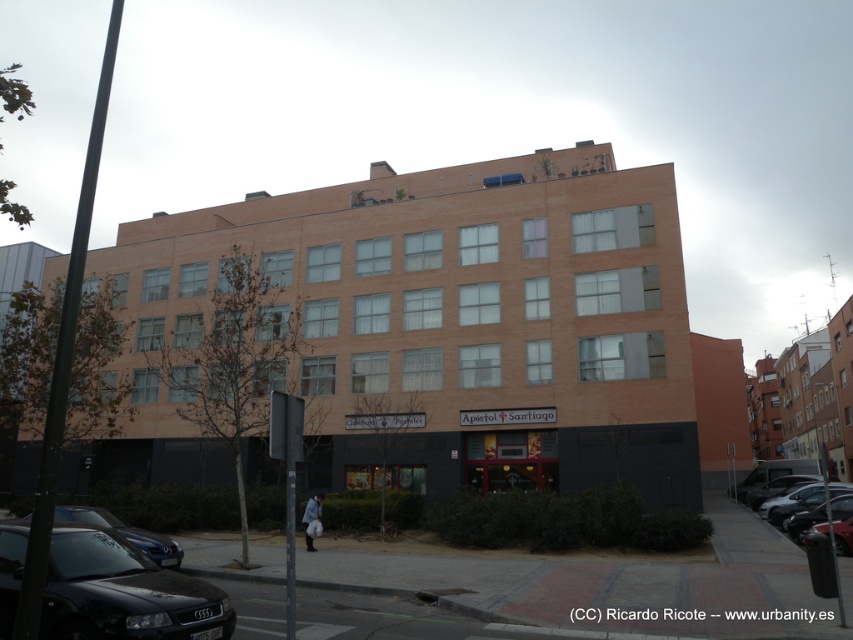
Question: Observing the image, what is the correct spatial positioning of brick building at center in reference to shiny black car at lower left?

Choices:
 (A) right
 (B) left

Answer: (B)

Question: Considering the real-world distances, which object is farthest from the metallic silver car at lower right?

Choices:
 (A) shiny black car at right
 (B) shiny black car at lower left
 (C) black glossy car at lower left
 (D) brick building at right

Answer: (D)

Question: Does brick building at center appear over metallic silver car at lower right?

Choices:
 (A) no
 (B) yes

Answer: (B)

Question: Which object appears farthest from the camera in this image?

Choices:
 (A) shiny black car at right
 (B) brick building at right
 (C) brick building at center

Answer: (A)

Question: Which point is closer to the camera?

Choices:
 (A) (796, 428)
 (B) (146, 628)
 (C) (399, 180)

Answer: (B)

Question: Can you confirm if shiny black car at right is smaller than metallic silver car at lower right?

Choices:
 (A) yes
 (B) no

Answer: (B)